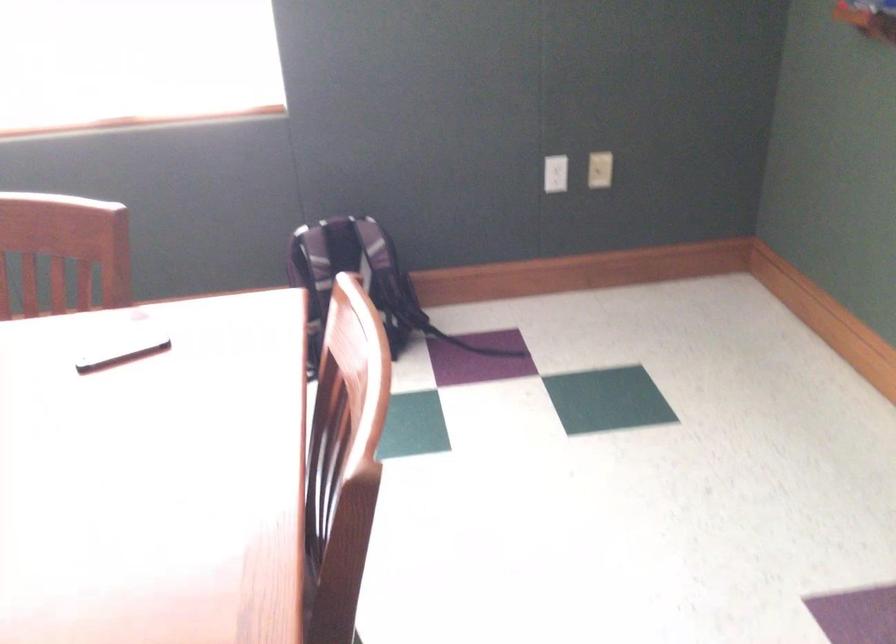
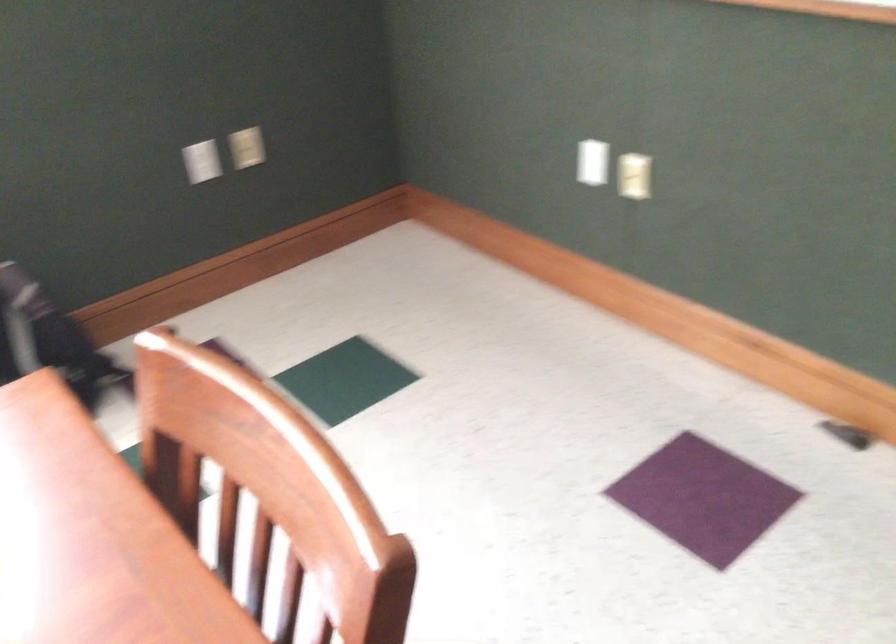
What movement of the cameraman would produce the second image?

The cameraman walked toward left, forward.